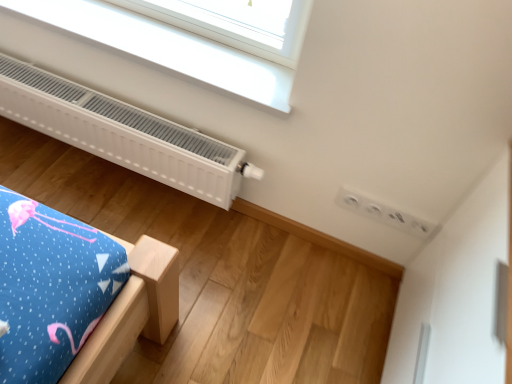
This screenshot has width=512, height=384. What do you see at coordinates (122, 133) in the screenshot? I see `white matte radiator at upper left` at bounding box center [122, 133].

Identify the location of white matte radiator at upper left. The height and width of the screenshot is (384, 512). (122, 133).

Where is `white plastic window at upper center`? Image resolution: width=512 pixels, height=384 pixels. white plastic window at upper center is located at coordinates (163, 47).

In order to face white plastic window at upper center, should I rotate leftwards or rightwards?

It's best to rotate left around 14.305 degrees.

Measure the distance between white plastic window at upper center and camera.

The distance of white plastic window at upper center from camera is 38.78 inches.

Image resolution: width=512 pixels, height=384 pixels. What do you see at coordinates (163, 47) in the screenshot?
I see `white plastic window at upper center` at bounding box center [163, 47].

The image size is (512, 384). I want to click on white matte radiator at upper left, so click(x=122, y=133).

Does white plastic window at upper center appear on the left side of white matte radiator at upper left?

Incorrect, white plastic window at upper center is not on the left side of white matte radiator at upper left.

Is white plastic window at upper center further to the viewer compared to white matte radiator at upper left?

No, white plastic window at upper center is closer to the camera.

Considering the positions of point (205, 47) and point (234, 160), is point (205, 47) closer or farther from the camera than point (234, 160)?

Point (205, 47).

From the image's perspective, which one is positioned higher, white plastic window at upper center or white matte radiator at upper left?

white plastic window at upper center is shown above in the image.

From a real-world perspective, which object rests below the other?

white matte radiator at upper left, from a real-world perspective.

Considering the sizes of white plastic window at upper center and white matte radiator at upper left in the image, is white plastic window at upper center wider or thinner than white matte radiator at upper left?

Considering their sizes, white plastic window at upper center looks broader than white matte radiator at upper left.

Considering the sizes of objects white plastic window at upper center and white matte radiator at upper left in the image provided, who is shorter, white plastic window at upper center or white matte radiator at upper left?

Standing shorter between the two is white plastic window at upper center.

Considering the sizes of objects white plastic window at upper center and white matte radiator at upper left in the image provided, who is smaller, white plastic window at upper center or white matte radiator at upper left?

With smaller size is white plastic window at upper center.

Is white plastic window at upper center positioned beyond the bounds of white matte radiator at upper left?

Yes.

Is the surface of white plastic window at upper center in direct contact with white matte radiator at upper left?

They are not placed beside each other.

Is white plastic window at upper center looking in the opposite direction of white matte radiator at upper left?

That's not correct — white plastic window at upper center is not looking away from white matte radiator at upper left.

What's the angular difference between white plastic window at upper center and white matte radiator at upper left's facing directions?

white plastic window at upper center and white matte radiator at upper left are facing 0.729 degrees away from each other.

You are a GUI agent. You are given a task and a screenshot of the screen. Output one action in this format:
    pyautogui.click(x=<x>, y=<y>)
    Task: Click on the window in front of the white matte radiator at upper left
    This screenshot has width=512, height=384.
    Given the screenshot: What is the action you would take?
    pyautogui.click(x=163, y=47)

Is white matte radiator at upper left at the left side of white plastic window at upper center?

Correct, you'll find white matte radiator at upper left to the left of white plastic window at upper center.

Which object is further away from the camera, white matte radiator at upper left or white plastic window at upper center?

white matte radiator at upper left is behind.

Does point (159, 128) come in front of point (160, 61)?

No.

From the image's perspective, between white matte radiator at upper left and white plastic window at upper center, who is located below?

white matte radiator at upper left, from the image's perspective.

From a real-world perspective, is white matte radiator at upper left positioned over white plastic window at upper center based on gravity?

No, from a real-world perspective, white matte radiator at upper left is not over white plastic window at upper center

Considering the sizes of objects white matte radiator at upper left and white plastic window at upper center in the image provided, who is thinner, white matte radiator at upper left or white plastic window at upper center?

With smaller width is white matte radiator at upper left.

Who is taller, white matte radiator at upper left or white plastic window at upper center?

white matte radiator at upper left is taller.

Which of these two, white matte radiator at upper left or white plastic window at upper center, is smaller?

white plastic window at upper center.

Is white matte radiator at upper left inside the boundaries of white plastic window at upper center, or outside?

white matte radiator at upper left lies outside white plastic window at upper center.

Is white matte radiator at upper left directly adjacent to white plastic window at upper center?

white matte radiator at upper left and white plastic window at upper center are clearly separated.

Is white matte radiator at upper left positioned with its back to white plastic window at upper center?

No.

Identify the location of window in front of the white matte radiator at upper left. (163, 47).

Where is `window located above the white matte radiator at upper left (from a real-world perspective)`? The width and height of the screenshot is (512, 384). window located above the white matte radiator at upper left (from a real-world perspective) is located at coordinates (163, 47).

You are a GUI agent. You are given a task and a screenshot of the screen. Output one action in this format:
    pyautogui.click(x=<x>, y=<y>)
    Task: Click on the heater on the left of white plastic window at upper center
    The width and height of the screenshot is (512, 384).
    Given the screenshot: What is the action you would take?
    pyautogui.click(x=122, y=133)